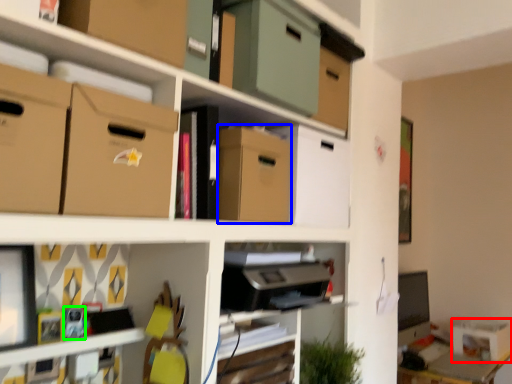
Question: Based on their relative distances, which object is nearer to storage box (highlighted by a red box)? Choose from cardboard box (highlighted by a blue box) and toy (highlighted by a green box).

Choices:
 (A) cardboard box
 (B) toy

Answer: (A)